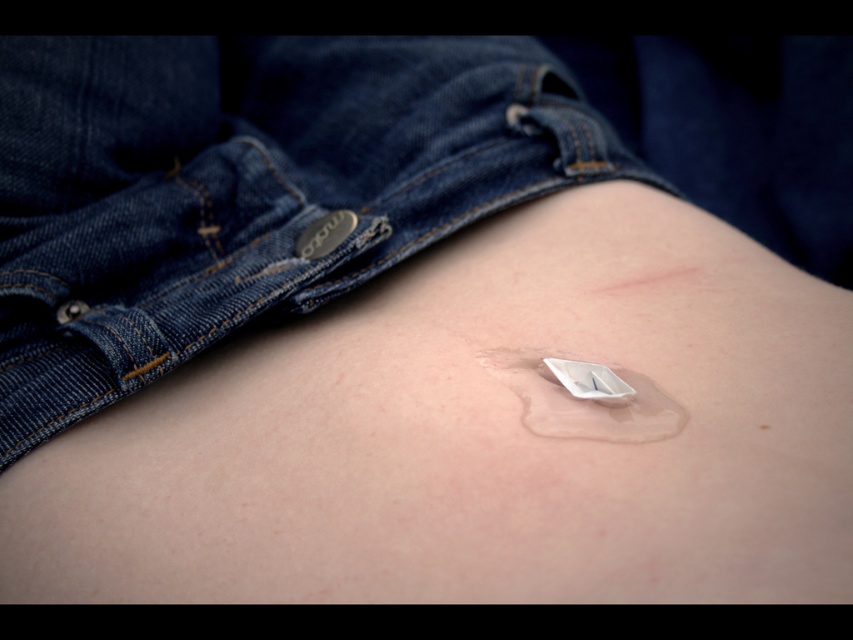
Question: Can you confirm if denim at center is bigger than white matte patch at center?

Choices:
 (A) no
 (B) yes

Answer: (B)

Question: Does denim at center appear on the left side of white matte patch at center?

Choices:
 (A) no
 (B) yes

Answer: (B)

Question: Which object appears farthest from the camera in this image?

Choices:
 (A) white matte patch at center
 (B) denim at center

Answer: (B)

Question: Can you confirm if denim at center is smaller than white matte patch at center?

Choices:
 (A) yes
 (B) no

Answer: (B)

Question: Which point is closer to the camera?

Choices:
 (A) white matte patch at center
 (B) denim at center

Answer: (A)

Question: Which point is farther from the camera taking this photo?

Choices:
 (A) (599, 403)
 (B) (36, 99)

Answer: (B)